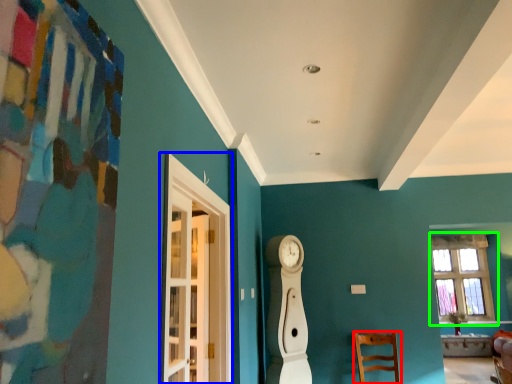
Question: Estimate the real-world distances between objects in this image. Which object is farther from chair (highlighted by a red box), glass door (highlighted by a blue box) or window (highlighted by a green box)?

Choices:
 (A) glass door
 (B) window

Answer: (A)